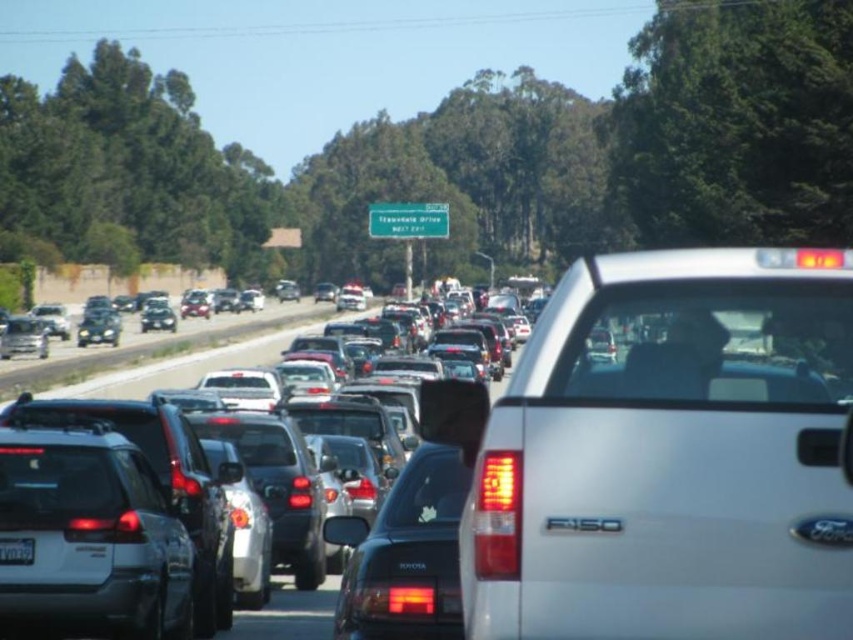
You are driving a car and need to park in a tight space that can only accommodate vehicles up to the width of the black plastic license plate at center. Based on the scene, can the matte black suv at center fit into this space?

The matte black suv at center might be wider than black plastic license plate at center, so it may not fit into the space designed for the license plate width.

You are driving a car that is 4.5 meters long. You want to overtake the white matte truck at center. Is there enough space between you and the truck to safely complete the maneuver?

The distance between you and the white matte truck at center is 4.77 meters. Since your car is 4.5 meters long, there is sufficient space to safely overtake the truck as the distance is greater than the length of your car.

In the scene shown: You are a pedestrian standing at the side of the highway. You see the white matte truck at center and the metallic silver cars at center. Which vehicle is closer to you?

The white matte truck at center is closer to you because it is positioned above the metallic silver cars at center, indicating it is in a more forward layer in the visual perspective.